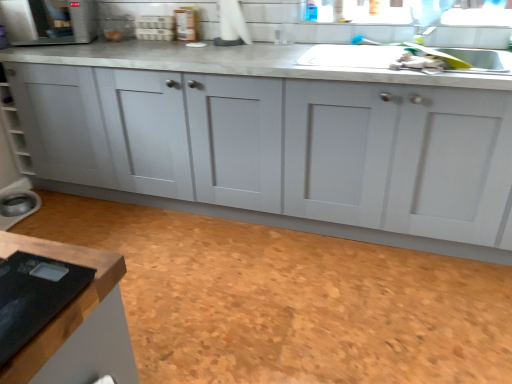
Where is `vacant area that is in front of matte brown jar at upper center, positioned as the 2th appliance in bottom-to-top order`? This screenshot has height=384, width=512. vacant area that is in front of matte brown jar at upper center, positioned as the 2th appliance in bottom-to-top order is located at coordinates (189, 42).